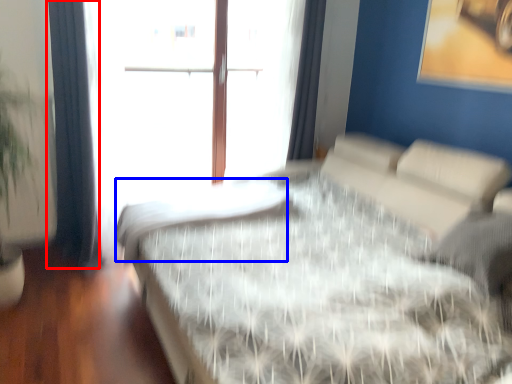
Question: Among these objects, which one is nearest to the camera, curtain (highlighted by a red box) or mattress (highlighted by a blue box)?

Choices:
 (A) curtain
 (B) mattress

Answer: (B)